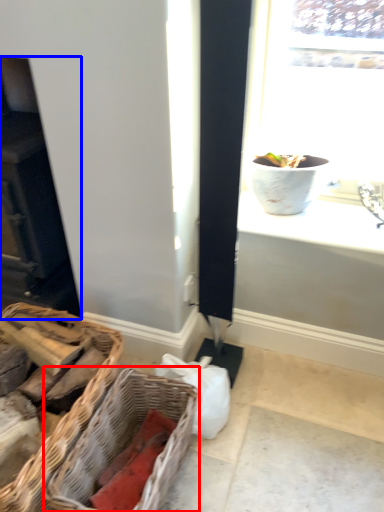
Question: Which object is closer to the camera taking this photo, picnic basket (highlighted by a red box) or fireplace (highlighted by a blue box)?

Choices:
 (A) picnic basket
 (B) fireplace

Answer: (A)